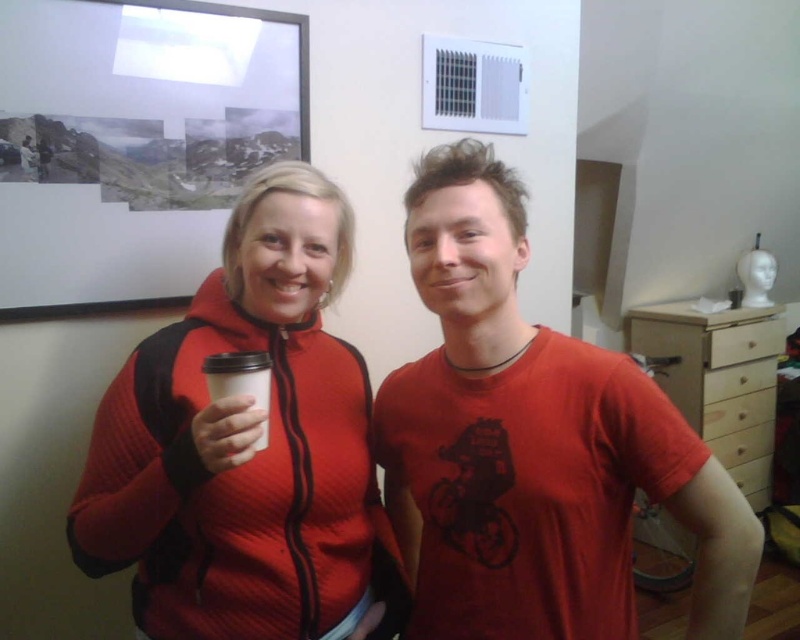
Is matte red jacket at center closer to the viewer compared to white paper cup at center?

→ That is True.

Between matte red jacket at center and white paper cup at center, which one has more height?

matte red jacket at center is taller.

Which is in front, point (224, 580) or point (225, 365)?

Point (225, 365) is more forward.

In order to click on matte red jacket at center in this screenshot , I will do `click(248, 445)`.

Is point (504, 586) farther from camera compared to point (348, 554)?

No, (504, 586) is in front of (348, 554).

Is point (568, 368) behind point (121, 508)?

Yes, point (568, 368) is behind point (121, 508).

Find the location of a particular element. The width and height of the screenshot is (800, 640). matte red t-shirt at center is located at coordinates (532, 444).

Image resolution: width=800 pixels, height=640 pixels. I want to click on matte red t-shirt at center, so click(532, 444).

Is point (486, 605) closer to camera compared to point (260, 380)?

No.

Locate an element on the screen. The image size is (800, 640). matte red t-shirt at center is located at coordinates (532, 444).